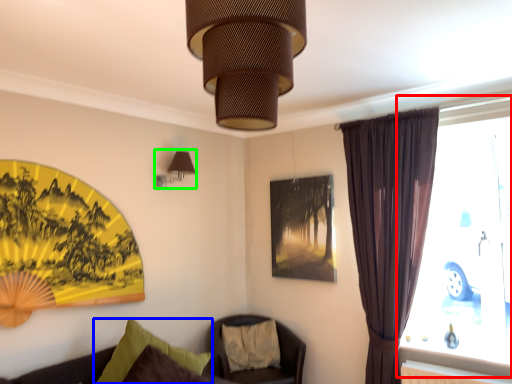
Question: Based on their relative distances, which object is farther from window (highlighted by a red box)? Choose from pillow (highlighted by a blue box) and lamp (highlighted by a green box).

Choices:
 (A) pillow
 (B) lamp

Answer: (B)